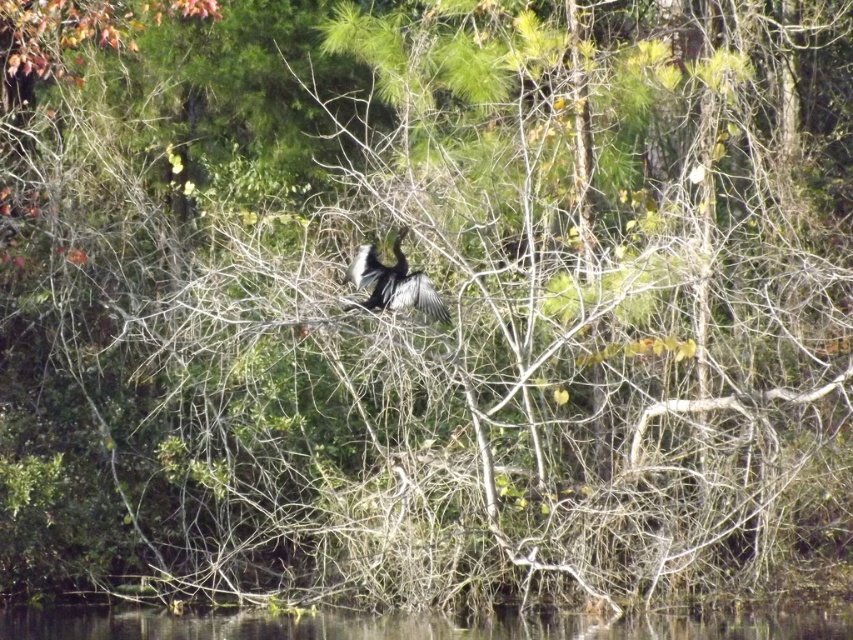
You are a photographer trying to capture the black glossy bird at center in a photo. You want to ensure the clear water at lower center doesn be too prominent in the background. Should you use a wide aperture or a narrow aperture to achieve this?

To minimize the prominence of the clear water at lower center, you should use a wide aperture. This creates a shallow depth of field, blurring the background and keeping the black glossy bird at center in focus.

You are standing in the forest and see two points in the image. Which point is closer to you, point (325, 609) or point (367, 252)?

Point (367, 252) is closer to you because it is less further to the camera than point (325, 609).

You are a photographer aiming to capture the black glossy bird at center and the clear water at lower center in a single frame. Based on their positions, which object would appear closer to the camera lens?

The black glossy bird at center appears closer to the camera lens because it is taller than the clear water at lower center, indicating it is positioned in front of the water.